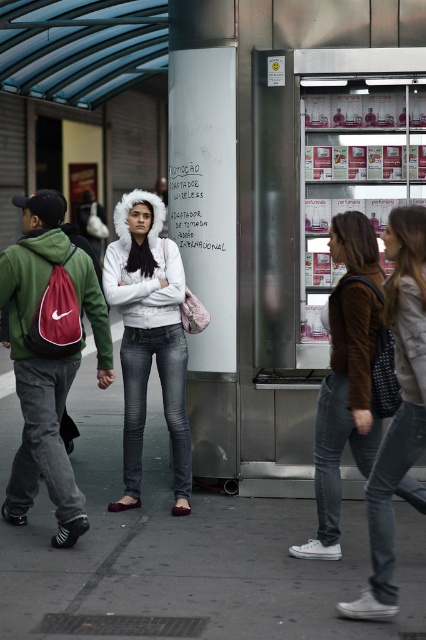
You are standing at the center of the street scene and want to hand a brochure to the person carrying the red fabric backpack at left. Which direction should you move to reach them?

The red fabric backpack at left is located at point 0.556 on the x and 0.115 on the y coordinates, so you should move to the left and slightly forward to reach the person carrying it.